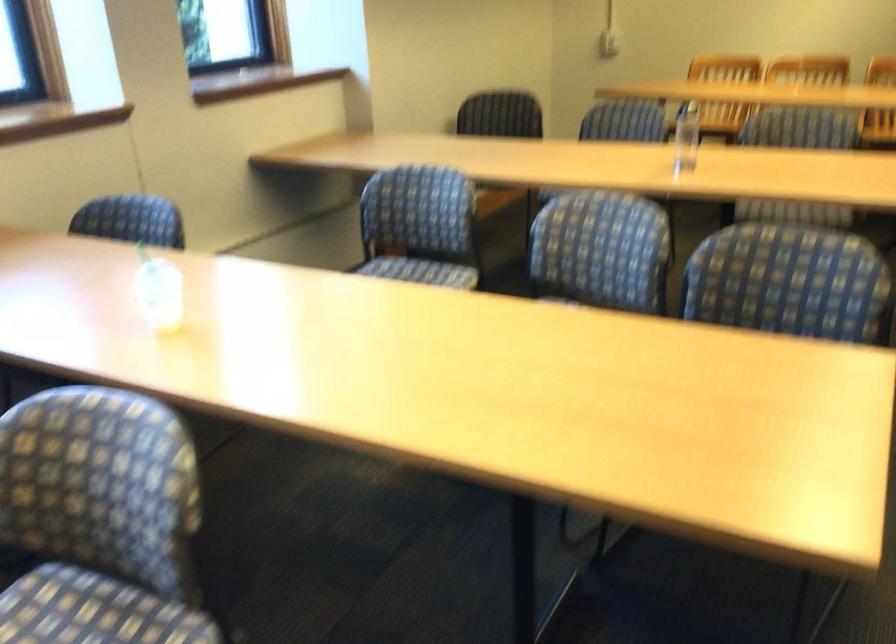
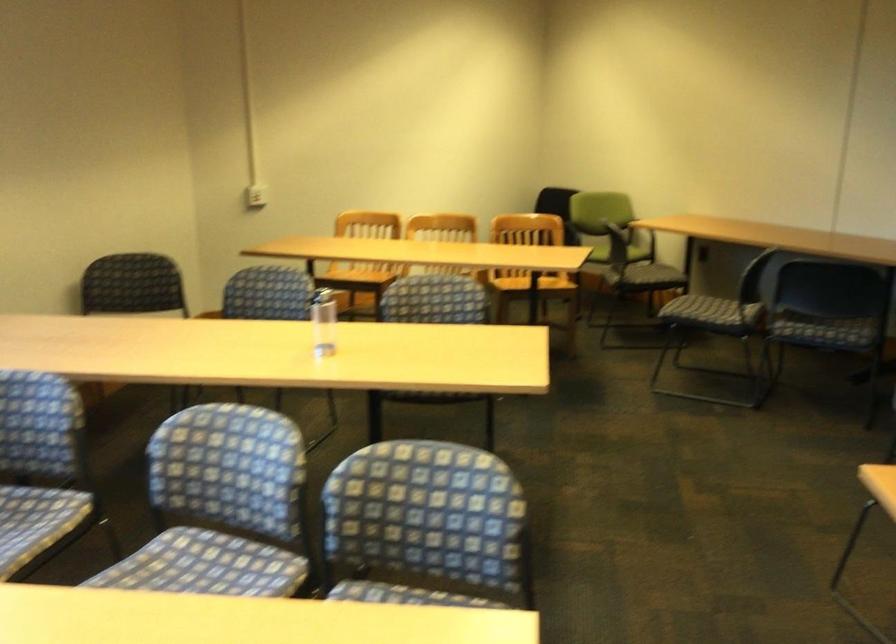
Where in the second image is the point corresponding to [685,134] from the first image?

(323, 322)